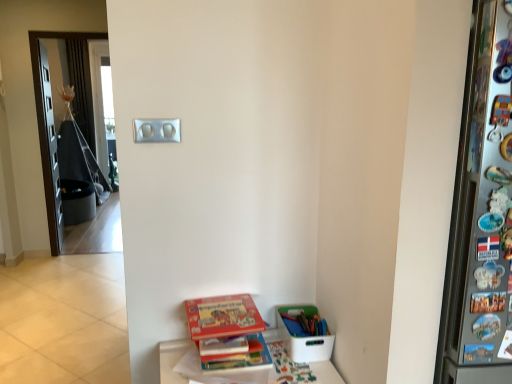
This screenshot has width=512, height=384. I want to click on free spot in front of white plastic container at lower right, so click(x=305, y=371).